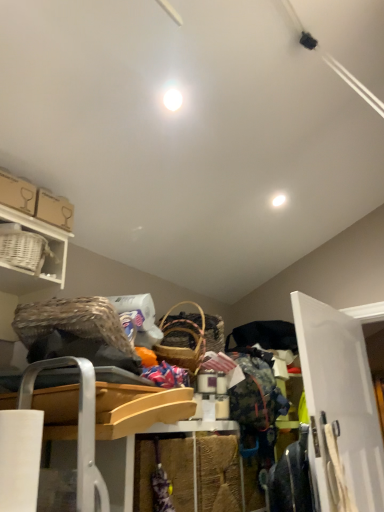
Question: Considering the relative positions of white wicker basket at upper left and white glossy light fixture at upper center, marked as the 2th light in a top-to-bottom arrangement, in the image provided, is white wicker basket at upper left behind white glossy light fixture at upper center, marked as the 2th light in a top-to-bottom arrangement,?

Choices:
 (A) yes
 (B) no

Answer: (B)

Question: From the image's perspective, does white wicker basket at upper left appear higher than white glossy light fixture at upper center, the 2th light in the front-to-back sequence?

Choices:
 (A) no
 (B) yes

Answer: (A)

Question: Is white wicker basket at upper left completely or partially outside of white glossy light fixture at upper center, the 1th light positioned from the back?

Choices:
 (A) yes
 (B) no

Answer: (A)

Question: Is white wicker basket at upper left wider than white glossy light fixture at upper center, which ranks as the 1th light in right-to-left order?

Choices:
 (A) yes
 (B) no

Answer: (A)

Question: Is white wicker basket at upper left to the right of white glossy light fixture at upper center, positioned as the 2th light in left-to-right order, from the viewer's perspective?

Choices:
 (A) yes
 (B) no

Answer: (B)

Question: Is white wicker basket at upper left bigger than white glossy light fixture at upper center, positioned as the 2th light in left-to-right order?

Choices:
 (A) yes
 (B) no

Answer: (A)

Question: Is floral fabric dress at lower right positioned before white wicker basket at upper left?

Choices:
 (A) no
 (B) yes

Answer: (A)

Question: From a real-world perspective, is floral fabric dress at lower right on white wicker basket at upper left?

Choices:
 (A) no
 (B) yes

Answer: (A)

Question: Considering the relative sizes of floral fabric dress at lower right and white wicker basket at upper left in the image provided, is floral fabric dress at lower right wider than white wicker basket at upper left?

Choices:
 (A) yes
 (B) no

Answer: (B)

Question: Is floral fabric dress at lower right far from white wicker basket at upper left?

Choices:
 (A) yes
 (B) no

Answer: (A)

Question: Considering the relative positions of floral fabric dress at lower right and white wicker basket at upper left in the image provided, is floral fabric dress at lower right to the right of white wicker basket at upper left from the viewer's perspective?

Choices:
 (A) yes
 (B) no

Answer: (A)

Question: Is floral fabric dress at lower right at the left side of white wicker basket at upper left?

Choices:
 (A) yes
 (B) no

Answer: (B)

Question: Is white glossy light fixture at upper center, positioned as the 2th light in left-to-right order, with white wicker basket at upper left?

Choices:
 (A) yes
 (B) no

Answer: (B)